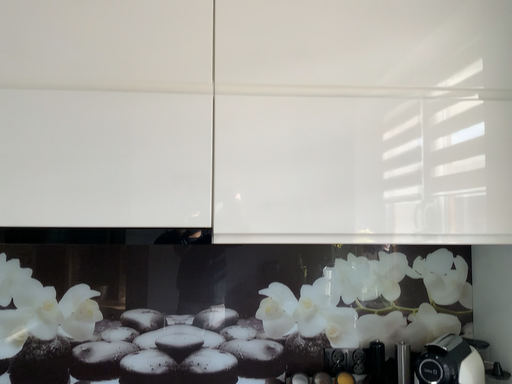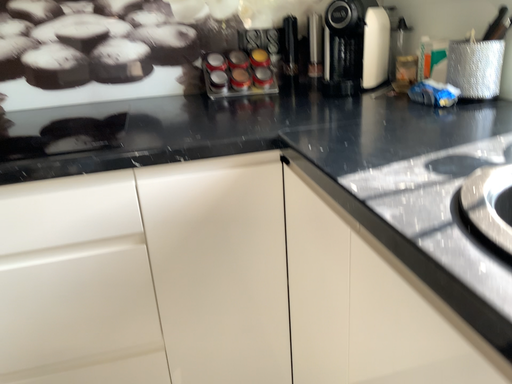
Question: How did the camera likely rotate when shooting the video?

Choices:
 (A) rotated downward
 (B) rotated upward

Answer: (A)